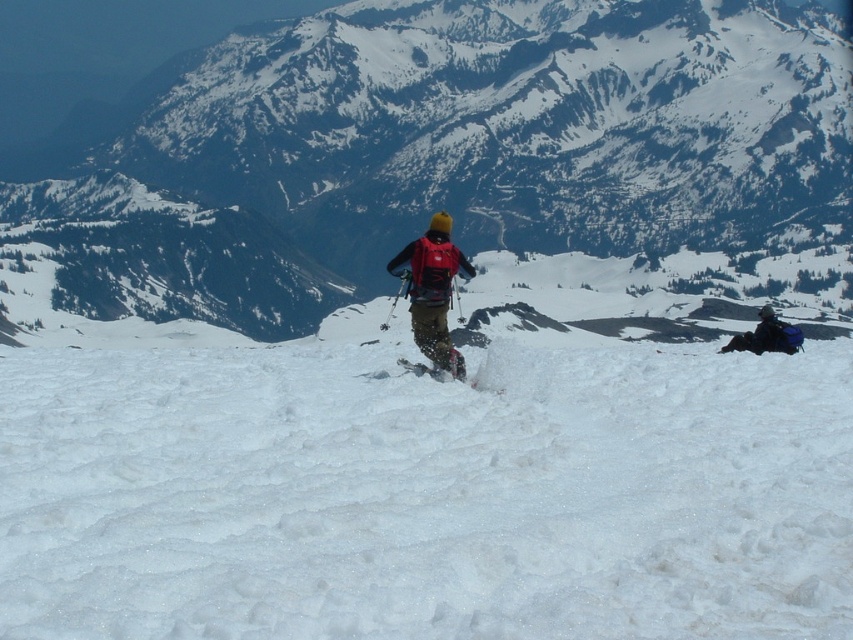
Looking at this image, you are planning to place a red flag exactly between the white snow at center and the matte black ski at center. According to the scene description, which object will the flag be closer to?

The white snow at center is to the left of matte black ski at center, so the red flag placed between them would be closer to the white snow at center.